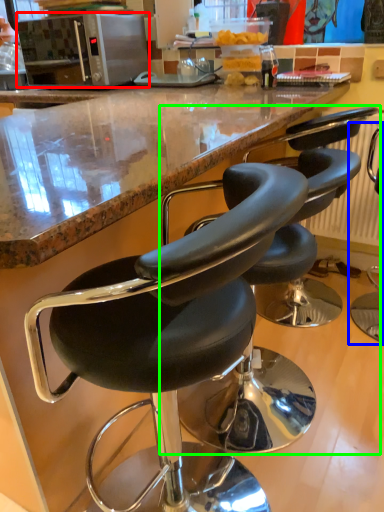
Question: Based on their relative distances, which object is nearer to microwave oven (highlighted by a red box)? Choose from chair (highlighted by a blue box) and chair (highlighted by a green box).

Choices:
 (A) chair
 (B) chair

Answer: (A)